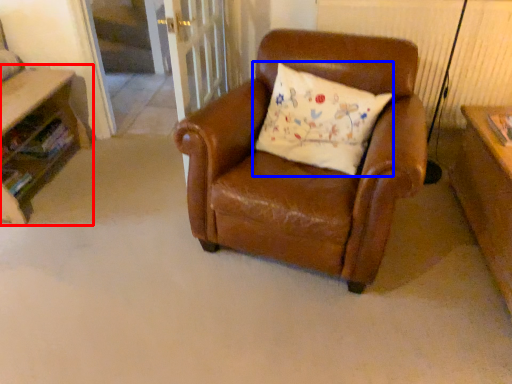
Question: Which of the following is the closest to the observer, table (highlighted by a red box) or pillow (highlighted by a blue box)?

Choices:
 (A) table
 (B) pillow

Answer: (B)